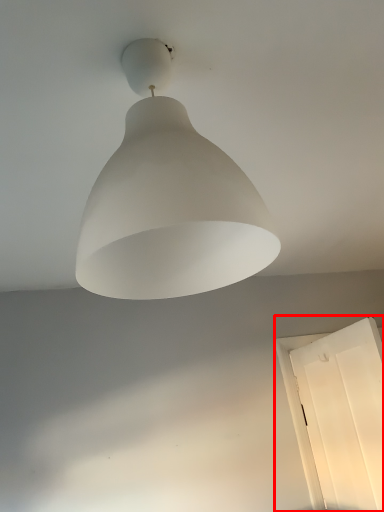
Question: From the image's perspective, where is window (annotated by the red box) located in relation to lamp in the image?

Choices:
 (A) above
 (B) below

Answer: (B)